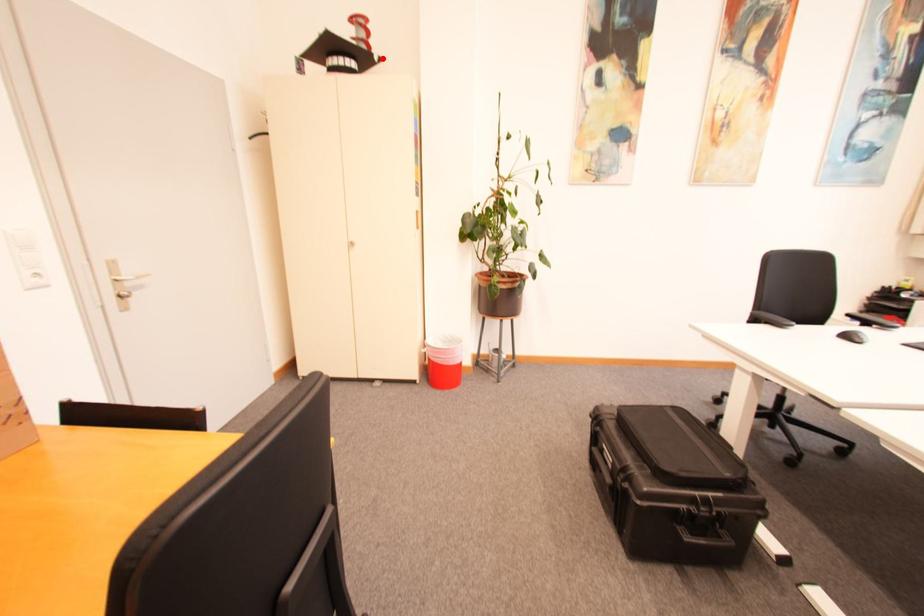
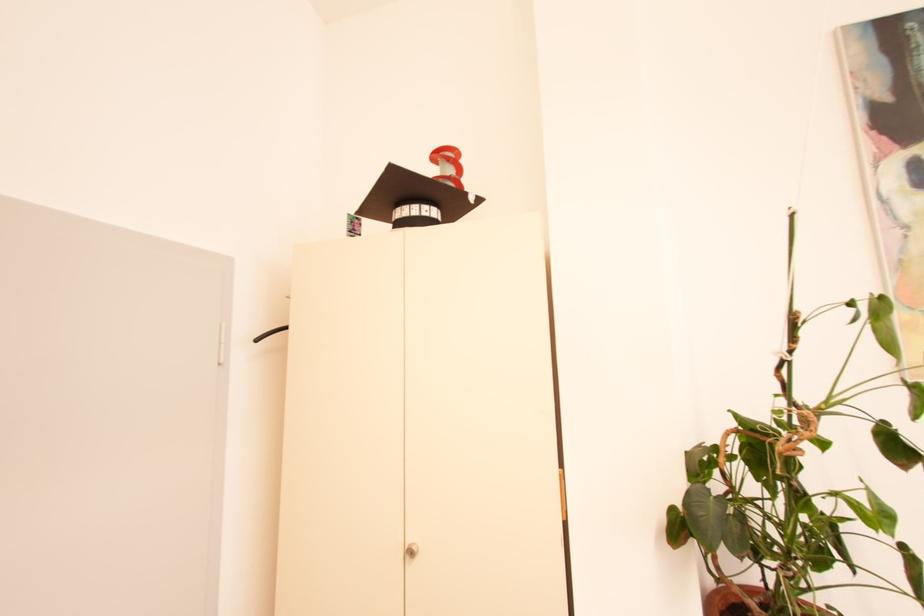
Find the pixel in the second image that matches the highlighted location in the first image.

(478, 199)